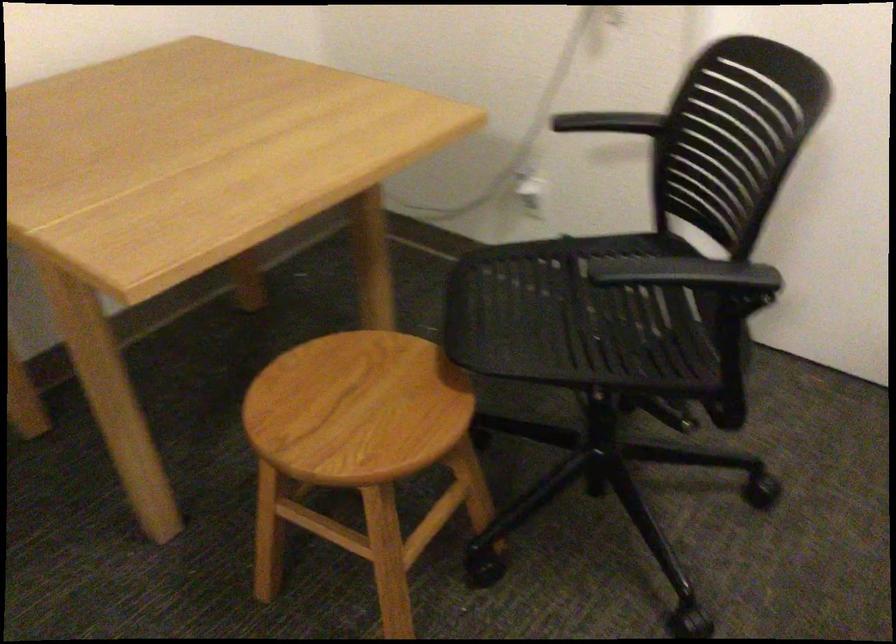
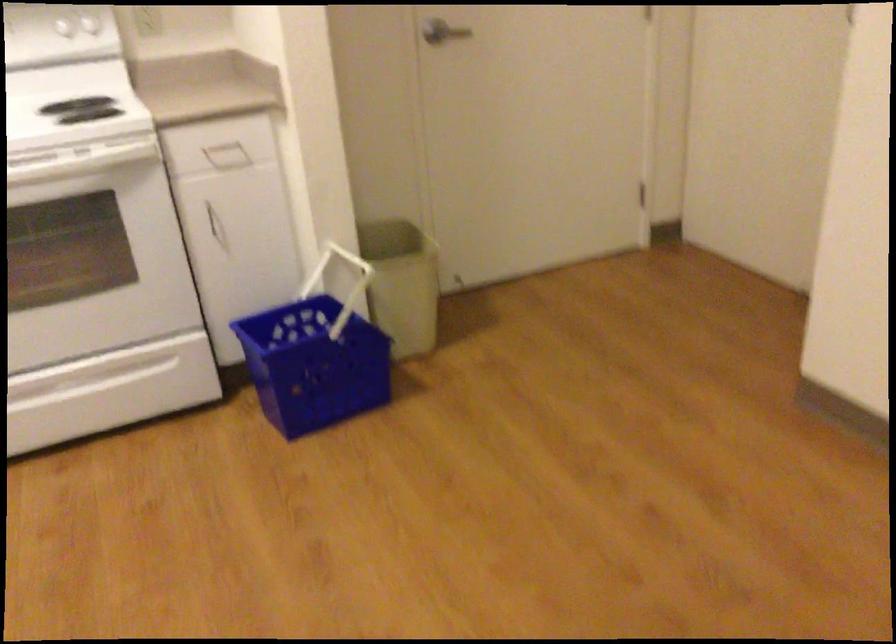
Based on the photo, the first image is from the beginning of the video and the second image is from the end. How did the camera likely rotate when shooting the video?

The camera's rotation is toward left-down.